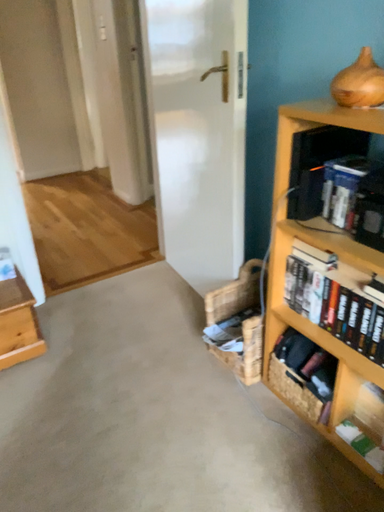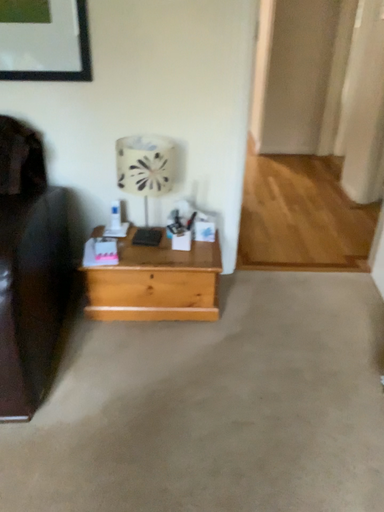
Question: How did the camera likely rotate when shooting the video?

Choices:
 (A) rotated right
 (B) rotated left

Answer: (B)